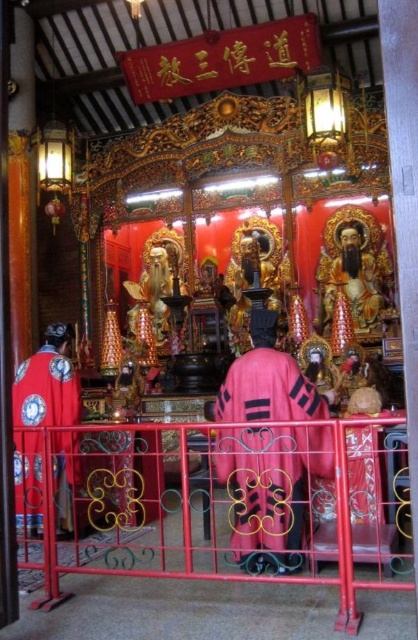
You are standing in the traditional Chinese temple and want to approach the altar. There is a metallic red railing at center. Can you walk directly towards the altar from your current position without crossing any obstacles?

The metallic red railing at center is located at point [216,506], which suggests it is positioned between you and the altar. Therefore, you cannot walk directly towards the altar without crossing the railing.

You are standing inside the temple and want to take a photo of both points mentioned. Which point is closer to you, point (x=229, y=508) or point (x=40, y=456)?

Point (x=229, y=508) is closer to the viewer than point (x=40, y=456).

You are a visitor standing at the entrance of the temple. You see the metallic red railing at center and the velvet pink robe at center. Which object is closer to you?

The metallic red railing at center is closer to you because it is in front of the velvet pink robe at center.